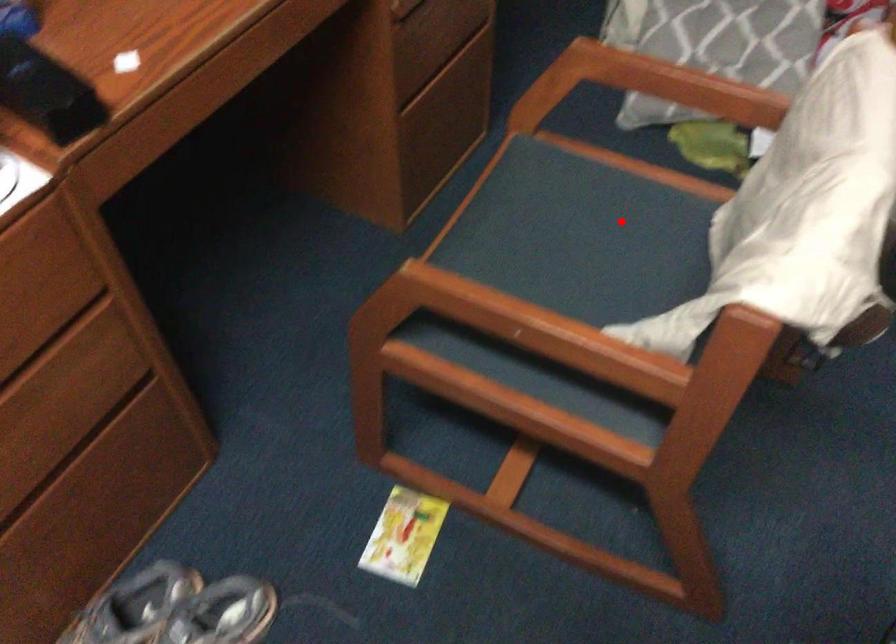
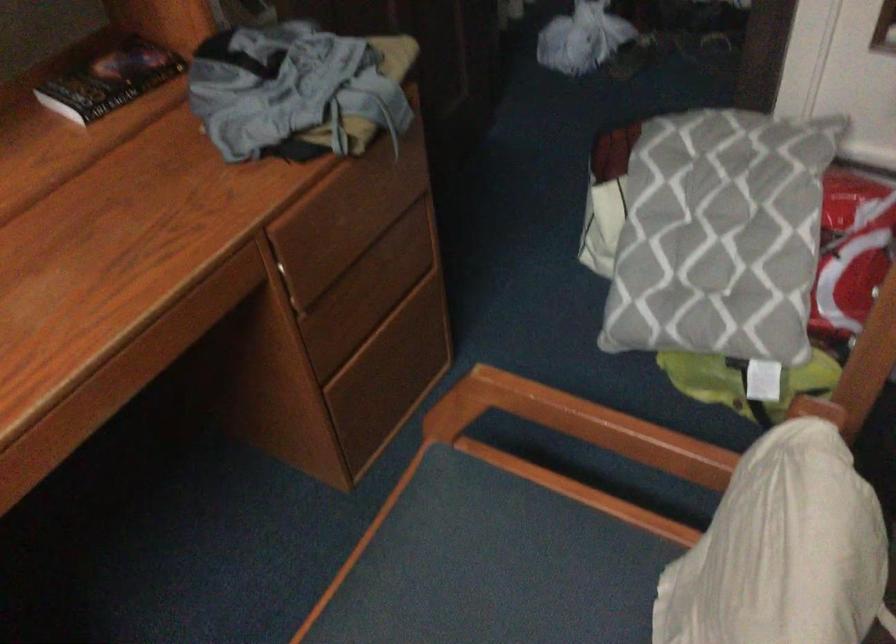
In the second image, find the point that corresponds to the highlighted location in the first image.

(549, 580)